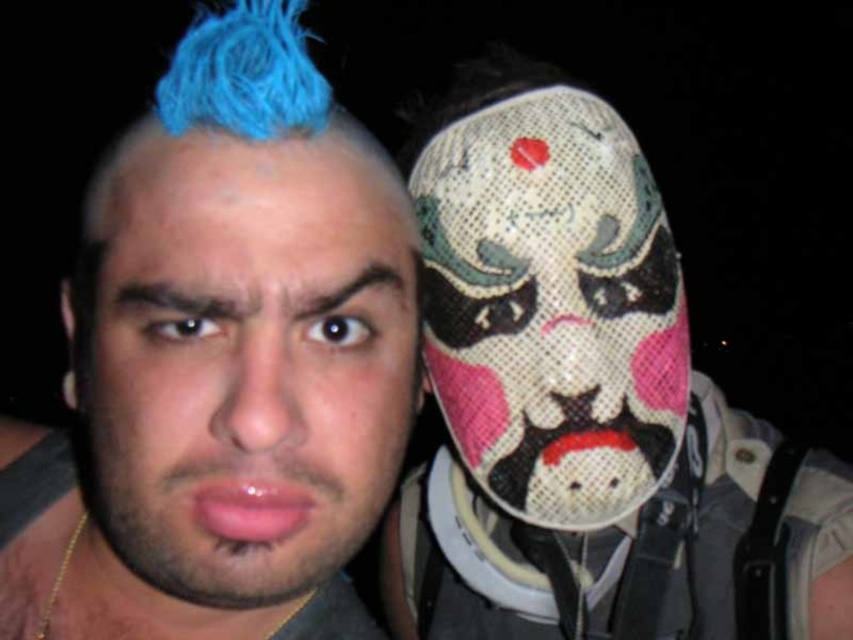
Is mesh fabric mask at right to the left of matte blue hair at left from the viewer's perspective?

No, mesh fabric mask at right is not to the left of matte blue hair at left.

Is mesh fabric mask at right bigger than matte blue hair at left?

Yes.

Image resolution: width=853 pixels, height=640 pixels. I want to click on mesh fabric mask at right, so coord(585,403).